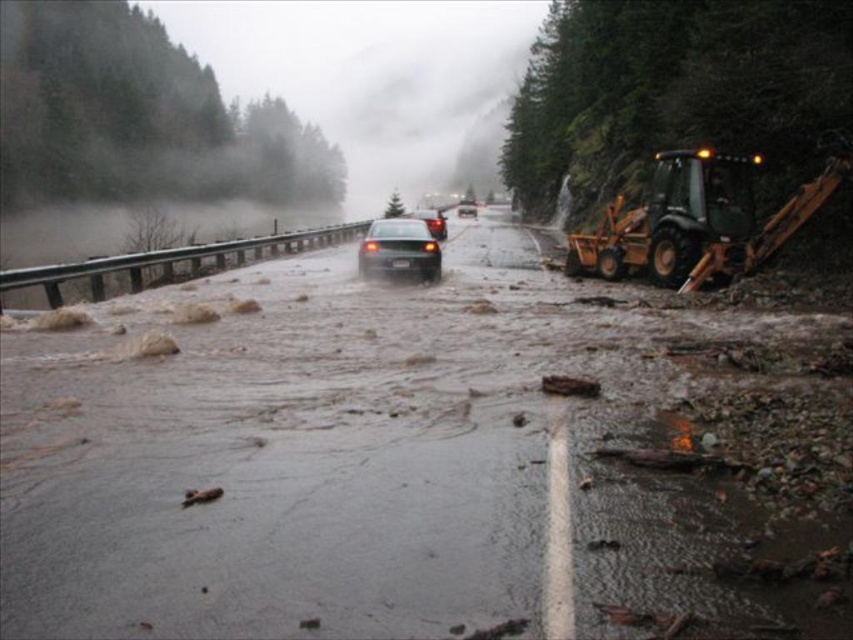
You are a driver trying to cross the flooded road. You see the brown muddy water at center and the green rubber excavator at right. Which one has a higher height?

The green rubber excavator at right has a greater height than the brown muddy water at center.

You are a driver trying to cross the flooded road. You see the brown muddy water at center and the black glossy sedan at center. Which object is higher in this scene?

The brown muddy water at center is much taller than the black glossy sedan at center.